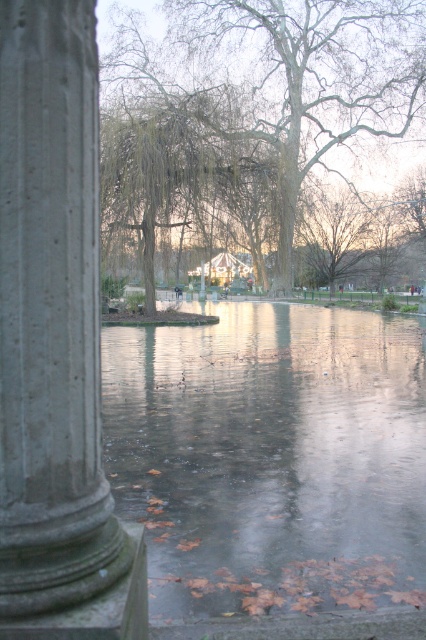
Question: Does translucent ice at center have a smaller size compared to gray stone column at left?

Choices:
 (A) yes
 (B) no

Answer: (B)

Question: Which point is closer to the camera taking this photo?

Choices:
 (A) [293, 387]
 (B) [229, 52]

Answer: (A)

Question: Among these objects, which one is farthest from the camera?

Choices:
 (A) translucent ice at center
 (B) gray stone column at left

Answer: (A)

Question: Is translucent ice at center below smooth bark tree at center?

Choices:
 (A) no
 (B) yes

Answer: (B)

Question: Can you confirm if gray stone column at left is positioned below smooth bark tree at center?

Choices:
 (A) no
 (B) yes

Answer: (B)

Question: Estimate the real-world distances between objects in this image. Which object is closer to the gray stone column at left?

Choices:
 (A) smooth bark tree at center
 (B) translucent ice at center

Answer: (B)